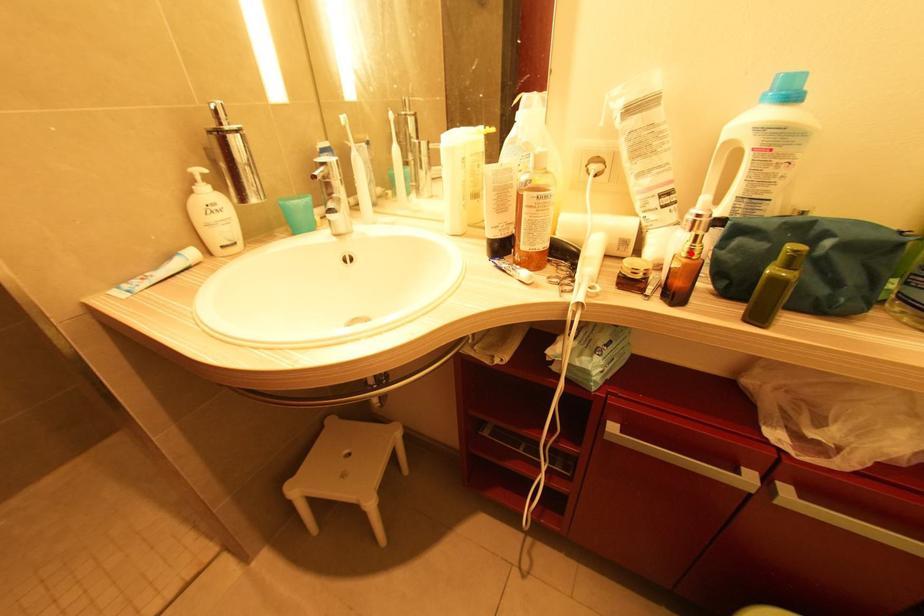
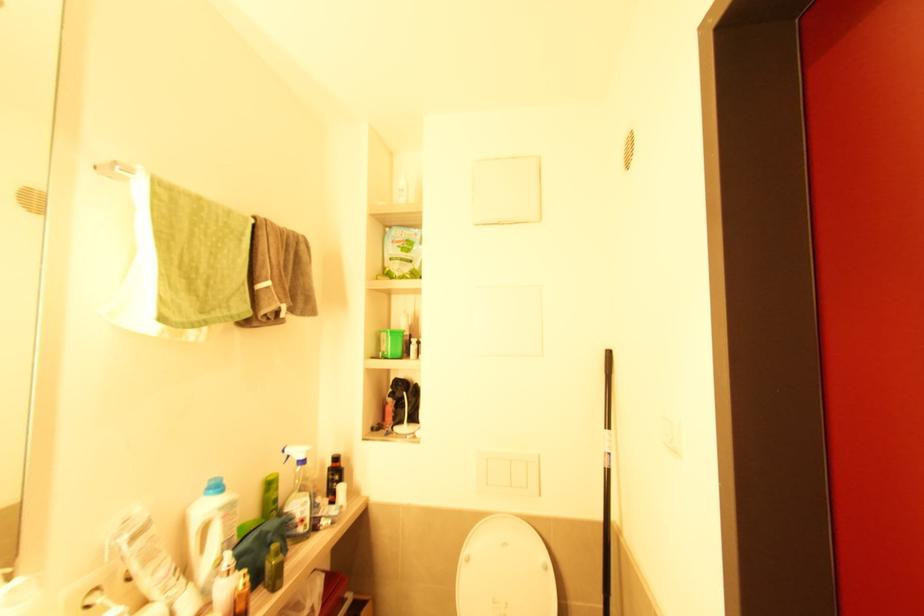
The point at the highlighted location is marked in the first image. Where is the corresponding point in the second image?

(247, 585)